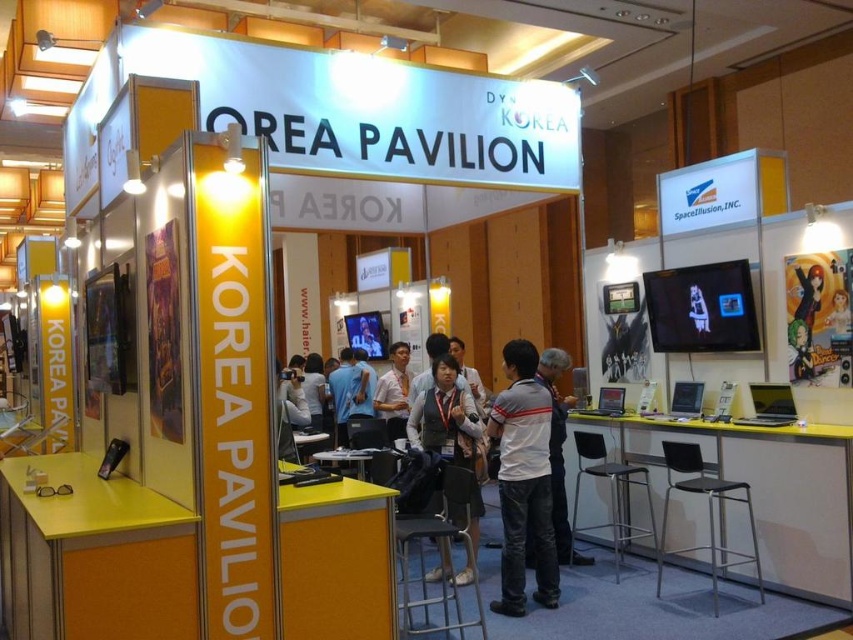
Can you confirm if gray/white striped shirt at center is wider than matte gray vest at center?

No, gray/white striped shirt at center is not wider than matte gray vest at center.

Between point (538, 604) and point (453, 448), which one is positioned in front?

Point (538, 604) is in front.

Locate an element on the screen. This screenshot has width=853, height=640. gray/white striped shirt at center is located at coordinates (523, 481).

Who is positioned more to the right, matte gray vest at center or white fabric jacket at center?

Positioned to the right is white fabric jacket at center.

Is matte gray vest at center positioned in front of white fabric jacket at center?

That is False.

Describe the element at coordinates (445, 417) in the screenshot. I see `matte gray vest at center` at that location.

Image resolution: width=853 pixels, height=640 pixels. Identify the location of matte gray vest at center. (445, 417).

Does gray/white striped shirt at center have a greater height compared to white fabric jacket at center?

Indeed, gray/white striped shirt at center has a greater height compared to white fabric jacket at center.

Does gray/white striped shirt at center appear over white fabric jacket at center?

Yes, gray/white striped shirt at center is above white fabric jacket at center.

Who is more distant from viewer, (496, 404) or (556, 508)?

Positioned behind is point (556, 508).

Find the location of a particular element. This screenshot has height=640, width=853. gray/white striped shirt at center is located at coordinates (523, 481).